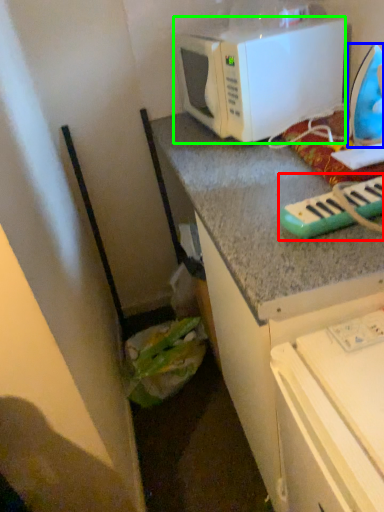
Question: Which object is positioned farthest from musical keyboard (highlighted by a red box)? Select from appliance (highlighted by a blue box) and microwave oven (highlighted by a green box).

Choices:
 (A) appliance
 (B) microwave oven

Answer: (B)